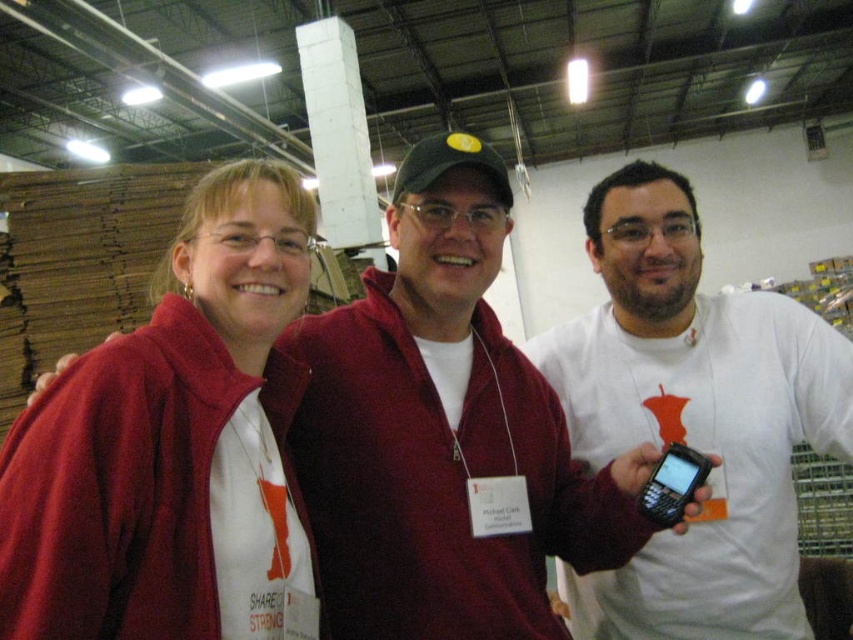
Where is `matte red jacket at center`? The image size is (853, 640). matte red jacket at center is located at coordinates [169, 445].

Does matte red jacket at center have a smaller size compared to white matte shirt at center?

Indeed, matte red jacket at center has a smaller size compared to white matte shirt at center.

Describe the element at coordinates (169, 445) in the screenshot. I see `matte red jacket at center` at that location.

Locate an element on the screen. This screenshot has height=640, width=853. matte red jacket at center is located at coordinates (169, 445).